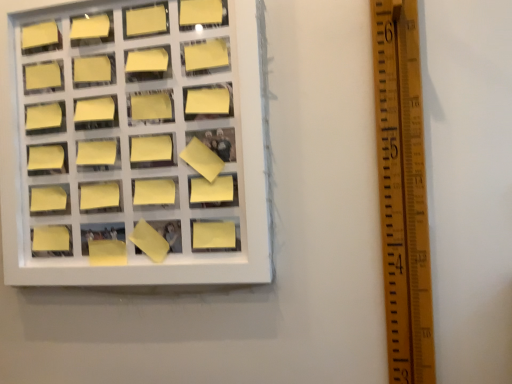
Locate an element on the screen. The image size is (512, 384). wooden ruler at right is located at coordinates tap(403, 191).

The image size is (512, 384). What do you see at coordinates (100, 197) in the screenshot?
I see `yellow matte sticky note at center-left, which is the tenth square from top to bottom` at bounding box center [100, 197].

Identify the location of yellow matte sticky note at upper left, which is the 8th square in top-to-bottom order. The height and width of the screenshot is (384, 512). (98, 154).

Describe the element at coordinates (96, 113) in the screenshot. I see `yellow matte sticky note at upper left, the sixth square viewed from the top` at that location.

Where is `wooden ruler at right`? This screenshot has height=384, width=512. wooden ruler at right is located at coordinates (403, 191).

Consider the image. Which point is more forward, (94,184) or (135,201)?

Positioned in front is point (135,201).

From a real-world perspective, is yellow matte sticky note at center-left, which is the tenth square from top to bottom, beneath yellow matte sticky note at center-left, the third square in the bottom-to-top sequence?

Yes, from a real-world perspective, yellow matte sticky note at center-left, which is the tenth square from top to bottom, is beneath yellow matte sticky note at center-left, the third square in the bottom-to-top sequence.

How distant is yellow matte sticky note at center-left, which is the tenth square from top to bottom, from yellow matte sticky note at center-left, which is the 9th square in top-to-bottom order?

yellow matte sticky note at center-left, which is the tenth square from top to bottom, is 4.80 inches from yellow matte sticky note at center-left, which is the 9th square in top-to-bottom order.

Who is shorter, yellow matte sticky note at center-left, which is the tenth square from top to bottom, or yellow matte sticky note at center-left, which is the 9th square in top-to-bottom order?

yellow matte sticky note at center-left, which is the tenth square from top to bottom, is shorter.

Which of these two, yellow matte sticky note at upper left, acting as the 4th square starting from the bottom, or yellow matte sticky note at lower left, arranged as the 11th square when viewed from the top, is bigger?

With larger size is yellow matte sticky note at lower left, arranged as the 11th square when viewed from the top.

From a real-world perspective, between yellow matte sticky note at upper left, acting as the 4th square starting from the bottom, and yellow matte sticky note at lower left, placed as the first square when sorted from bottom to top, who is vertically higher?

From a 3D spatial view, yellow matte sticky note at upper left, acting as the 4th square starting from the bottom, is above.

Could yellow matte sticky note at lower left, arranged as the 11th square when viewed from the top, be considered to be inside yellow matte sticky note at upper left, which is the 8th square in top-to-bottom order?

No, yellow matte sticky note at lower left, arranged as the 11th square when viewed from the top, is not inside yellow matte sticky note at upper left, which is the 8th square in top-to-bottom order.

Identify the location of square that is the 3rd one when counting upward from the yellow matte sticky note at lower left, placed as the first square when sorted from bottom to top (from the image's perspective). (98, 154).

From the picture: Is yellow matte sticky note at upper left, which is the 8th square in top-to-bottom order, far away from yellow matte sticky note at center-left, the third square in the bottom-to-top sequence?

No, yellow matte sticky note at upper left, which is the 8th square in top-to-bottom order, is not far away from yellow matte sticky note at center-left, the third square in the bottom-to-top sequence.

From a real-world perspective, is yellow matte sticky note at upper left, acting as the 4th square starting from the bottom, below yellow matte sticky note at center-left, the third square in the bottom-to-top sequence?

No, from a real-world perspective, yellow matte sticky note at upper left, acting as the 4th square starting from the bottom, is not beneath yellow matte sticky note at center-left, the third square in the bottom-to-top sequence.

Is yellow matte sticky note at upper left, acting as the 4th square starting from the bottom, turned away from yellow matte sticky note at center-left, which is the 9th square in top-to-bottom order?

No.

Between yellow matte sticky note at upper left, which is the 8th square in top-to-bottom order, and yellow matte sticky note at center-left, which is the 9th square in top-to-bottom order, which one has smaller size?

yellow matte sticky note at upper left, which is the 8th square in top-to-bottom order, is smaller.

Between point (170, 182) and point (167, 52), which one is positioned behind?

Point (170, 182)

What are the coordinates of `the 1st square in front of the yellow matte sticky note at upper center, placed as the 3th square when sorted from top to bottom` in the screenshot? It's located at (155, 193).

From a real-world perspective, between yellow matte sticky note at center-left, the third square in the bottom-to-top sequence, and yellow matte sticky note at upper center, placed as the 3th square when sorted from top to bottom, who is vertically higher?

yellow matte sticky note at upper center, placed as the 3th square when sorted from top to bottom, is physically above.

Is yellow matte sticky note at center-left, the third square in the bottom-to-top sequence, with yellow matte sticky note at upper center, placed as the 3th square when sorted from top to bottom?

No, yellow matte sticky note at center-left, the third square in the bottom-to-top sequence, is not next to yellow matte sticky note at upper center, placed as the 3th square when sorted from top to bottom.

Which object is positioned more to the left, yellow matte sticky note at center-left, which is the tenth square from top to bottom, or wooden ruler at right?

Positioned to the left is yellow matte sticky note at center-left, which is the tenth square from top to bottom.

From the image's perspective, which one is positioned higher, yellow matte sticky note at center-left, the second square positioned from the bottom, or wooden ruler at right?

wooden ruler at right is shown above in the image.

Is yellow matte sticky note at center-left, which is the tenth square from top to bottom, outside of wooden ruler at right?

Yes, yellow matte sticky note at center-left, which is the tenth square from top to bottom, is not within wooden ruler at right.

From the picture: From the image's perspective, between yellow matte sticky note at upper left, marked as the 4th square in a top-to-bottom arrangement, and yellow matte sticky note at upper left, acting as the second square starting from the top, who is located below?

yellow matte sticky note at upper left, marked as the 4th square in a top-to-bottom arrangement, is shown below in the image.

Could yellow matte sticky note at upper left, which is counted as the tenth square, starting from the bottom, be considered to be inside yellow matte sticky note at upper left, marked as the 4th square in a top-to-bottom arrangement?

No, yellow matte sticky note at upper left, marked as the 4th square in a top-to-bottom arrangement, does not contain yellow matte sticky note at upper left, which is counted as the tenth square, starting from the bottom.

Which is more to the left, yellow matte sticky note at upper left, arranged as the 8th square when ordered from the bottom, or yellow matte sticky note at upper left, acting as the second square starting from the top?

yellow matte sticky note at upper left, acting as the second square starting from the top, is more to the left.

Measure the distance between yellow matte sticky note at upper left, marked as the 4th square in a top-to-bottom arrangement, and yellow matte sticky note at upper left, acting as the second square starting from the top.

A distance of 3.50 inches exists between yellow matte sticky note at upper left, marked as the 4th square in a top-to-bottom arrangement, and yellow matte sticky note at upper left, acting as the second square starting from the top.

Is yellow matte sticky note at center-left, the third square in the bottom-to-top sequence, aimed at wooden ruler at right?

No, yellow matte sticky note at center-left, the third square in the bottom-to-top sequence, is not turned towards wooden ruler at right.

Consider the image. Is yellow matte sticky note at center-left, the third square in the bottom-to-top sequence, not close to wooden ruler at right?

Actually, yellow matte sticky note at center-left, the third square in the bottom-to-top sequence, and wooden ruler at right are a little close together.

You are a GUI agent. You are given a task and a screenshot of the screen. Output one action in this format:
    pyautogui.click(x=<x>, y=<y>)
    Task: Click on the ruler directly beneath the yellow matte sticky note at center-left, the third square in the bottom-to-top sequence (from a real-world perspective)
    
    Given the screenshot: What is the action you would take?
    pyautogui.click(x=403, y=191)

Measure the distance between yellow matte sticky note at center-left, which is the 9th square in top-to-bottom order, and wooden ruler at right.

yellow matte sticky note at center-left, which is the 9th square in top-to-bottom order, and wooden ruler at right are 67.90 centimeters apart from each other.

There is a yellow matte sticky note at center-left, which is the tenth square from top to bottom. Identify the location of the 1st square above it (from the image's perspective). Image resolution: width=512 pixels, height=384 pixels. (155, 193).

This screenshot has width=512, height=384. I want to click on the 3rd square below when counting from the yellow matte sticky note at upper left, acting as the 4th square starting from the bottom (from the image's perspective), so click(x=50, y=200).

When comparing their distances from yellow matte sticky note at upper center, placed as the 3th square when sorted from top to bottom, does yellow matte sticky note at lower left, placed as the first square when sorted from bottom to top, or yellow matte sticky note at upper left, the sixth square viewed from the top, seem further?

The object further to yellow matte sticky note at upper center, placed as the 3th square when sorted from top to bottom, is yellow matte sticky note at lower left, placed as the first square when sorted from bottom to top.

Which object lies nearer to the anchor point yellow matte sticky note at center-left, which is the tenth square from top to bottom, yellow matte sticky note at upper left, acting as the second square starting from the top, or yellow matte sticky note at upper center, the ninth square in the bottom-to-top sequence?

yellow matte sticky note at upper center, the ninth square in the bottom-to-top sequence.

Based on their spatial positions, is yellow matte sticky note at upper center, the first square viewed from the top, or yellow matte sticky note at upper left, acting as the second square starting from the top, further from yellow matte sticky note at center-left, the third square in the bottom-to-top sequence?

Based on the image, yellow matte sticky note at upper left, acting as the second square starting from the top, appears to be further to yellow matte sticky note at center-left, the third square in the bottom-to-top sequence.

Estimate the real-world distances between objects in this image. Which object is further from yellow matte sticky note at upper left, marked as the 4th square in a top-to-bottom arrangement, yellow matte sticky note at upper left, placed as the fifth square when sorted from bottom to top, or yellow matte sticky note at upper left, which is the 8th square in top-to-bottom order?

Based on the image, yellow matte sticky note at upper left, which is the 8th square in top-to-bottom order, appears to be further to yellow matte sticky note at upper left, marked as the 4th square in a top-to-bottom arrangement.

Estimate the real-world distances between objects in this image. Which object is further from yellow matte sticky note at upper center, the eleventh square positioned from the bottom, wooden ruler at right or yellow matte sticky note at center, the 7th square when ordered from bottom to top?

wooden ruler at right is further to yellow matte sticky note at upper center, the eleventh square positioned from the bottom.

Looking at the image, which one is located closer to yellow matte sticky note at upper center, the first square viewed from the top, yellow matte sticky note at center-left, which is the tenth square from top to bottom, or yellow matte sticky note at upper left, which is the 8th square in top-to-bottom order?

The object closer to yellow matte sticky note at upper center, the first square viewed from the top, is yellow matte sticky note at upper left, which is the 8th square in top-to-bottom order.

Which object lies further to the anchor point yellow matte sticky note at upper left, acting as the second square starting from the top, yellow matte sticky note at upper left, which is the 8th square in top-to-bottom order, or yellow matte sticky note at upper center, the first square viewed from the top?

yellow matte sticky note at upper left, which is the 8th square in top-to-bottom order, is positioned further to the anchor yellow matte sticky note at upper left, acting as the second square starting from the top.

In the scene shown: When comparing their distances from yellow matte sticky note at upper left, marked as the 4th square in a top-to-bottom arrangement, does yellow matte sticky note at lower left, arranged as the 11th square when viewed from the top, or yellow matte sticky note at upper center, placed as the 3th square when sorted from top to bottom, seem closer?

yellow matte sticky note at upper center, placed as the 3th square when sorted from top to bottom.

Locate an element on the screen. This screenshot has width=512, height=384. window frame situated between yellow matte sticky note at upper left, arranged as the 8th square when ordered from the bottom, and yellow matte sticky note at center, which is the fifth square in top-to-bottom order, from left to right is located at coordinates tap(140, 153).

Image resolution: width=512 pixels, height=384 pixels. In order to click on window frame between yellow matte sticky note at upper center, the ninth square in the bottom-to-top sequence, and yellow matte sticky note at center-left, the third square in the bottom-to-top sequence, in the up-down direction in this screenshot , I will do `click(140, 153)`.

Locate an element on the screen. The image size is (512, 384). window frame between yellow matte sticky note at upper left, the sixth square viewed from the top, and yellow matte sticky note at lower left, placed as the first square when sorted from bottom to top, from top to bottom is located at coordinates (140, 153).

In order to click on window frame between yellow matte sticky note at upper center, the eleventh square positioned from the bottom, and yellow matte sticky note at upper left, which is the 8th square in top-to-bottom order, in the up-down direction in this screenshot , I will do `click(140, 153)`.